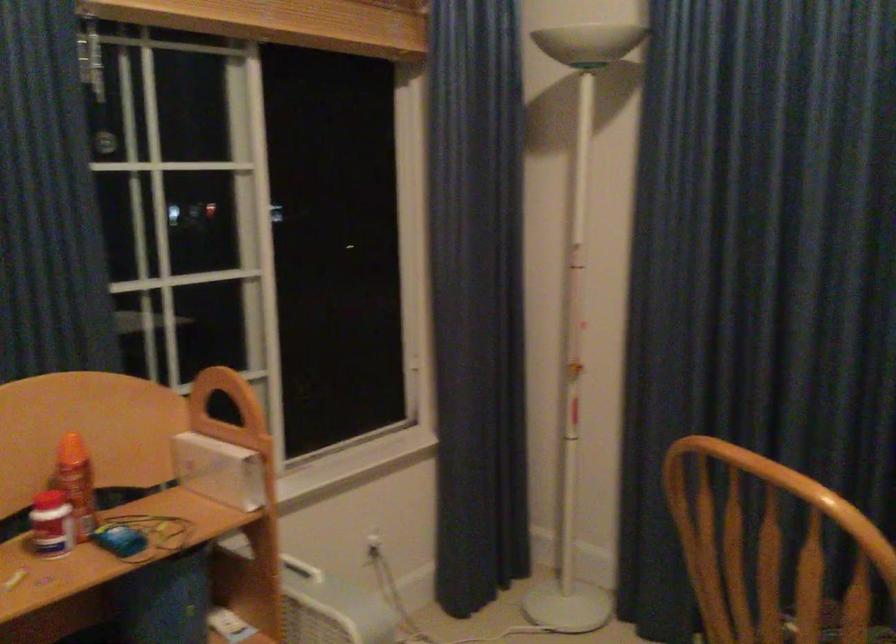
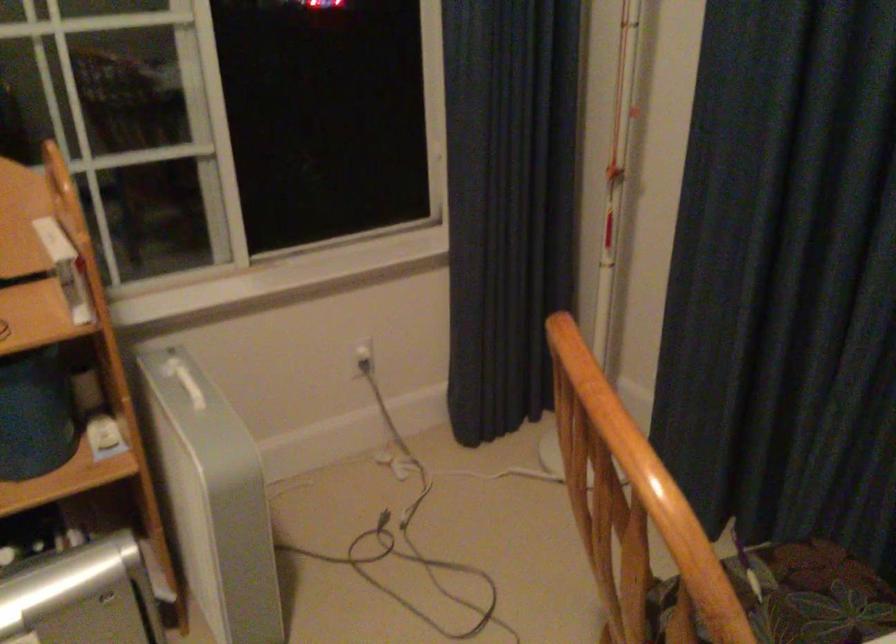
What movement of the cameraman would produce the second image?

The movement direction of the cameraman is right, forward.